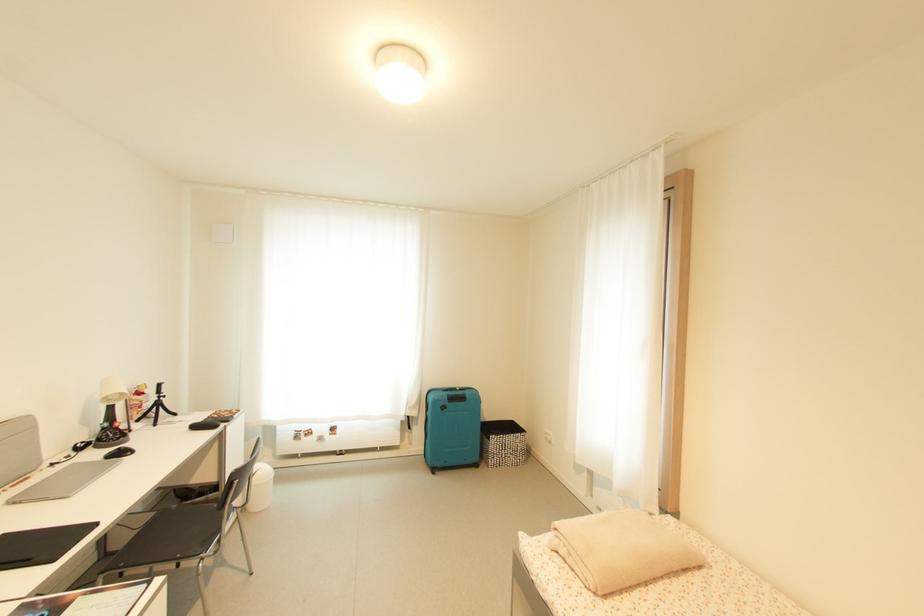
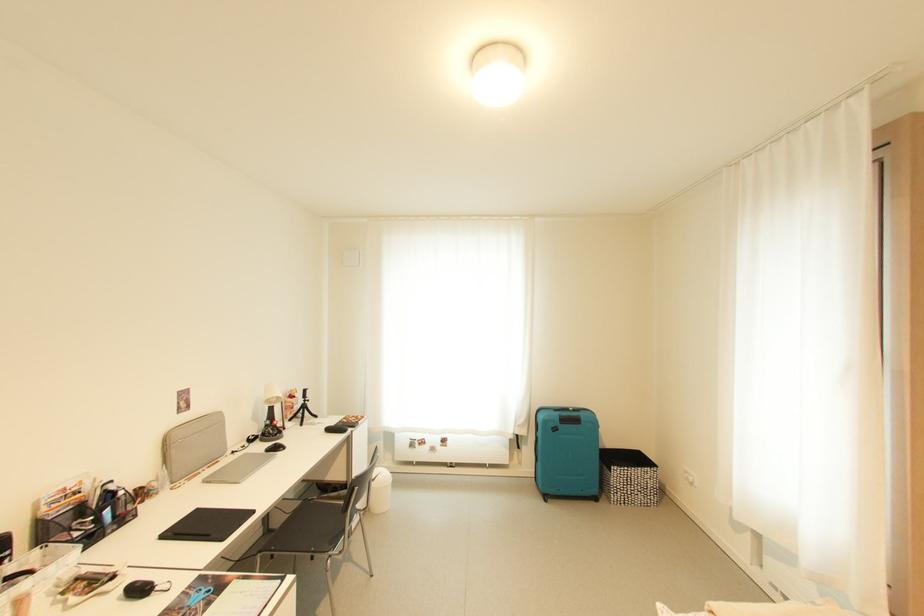
The point at (146, 408) is marked in the first image. Where is the corresponding point in the second image?

(297, 410)